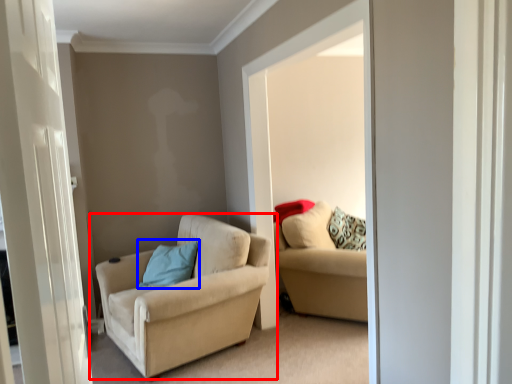
Question: Which of the following is the farthest to the observer, chair (highlighted by a red box) or pillow (highlighted by a blue box)?

Choices:
 (A) chair
 (B) pillow

Answer: (B)